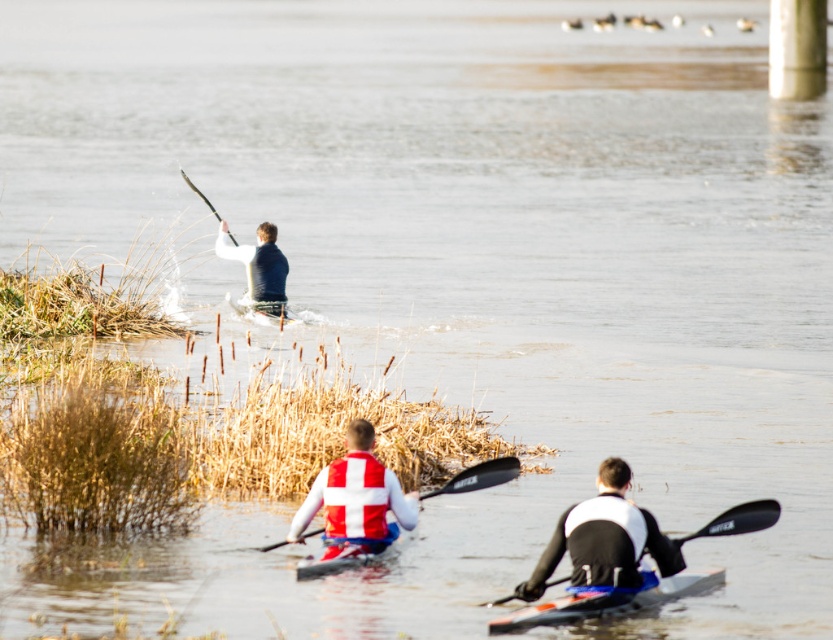
Question: Can you confirm if blue plastic kayak at lower center is wider than matte black kayak at upper left?

Choices:
 (A) yes
 (B) no

Answer: (A)

Question: Which point is closer to the camera?

Choices:
 (A) (387, 477)
 (B) (258, 282)
 (C) (616, 490)
 (D) (388, 536)

Answer: (C)

Question: Does blue plastic kayak at lower center appear on the right side of white plastic canoe at center?

Choices:
 (A) yes
 (B) no

Answer: (A)

Question: Which point appears farthest from the camera in this image?

Choices:
 (A) (746, 506)
 (B) (556, 598)
 (C) (383, 497)
 (D) (569, 552)

Answer: (C)

Question: Which is farther from the black plastic paddle at center?

Choices:
 (A) black plastic paddle at lower center
 (B) white plastic canoe at center
 (C) white matte life jacket at center
 (D) matte black kayak at upper left

Answer: (D)

Question: Can you confirm if black plastic paddle at lower center is thinner than black plastic paddle at center?

Choices:
 (A) yes
 (B) no

Answer: (B)